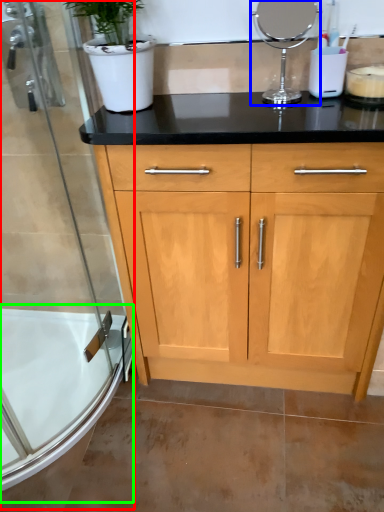
Question: Which object is positioned farthest from shower door (highlighted by a red box)? Select from appliance (highlighted by a blue box) and bath (highlighted by a green box).

Choices:
 (A) appliance
 (B) bath

Answer: (A)